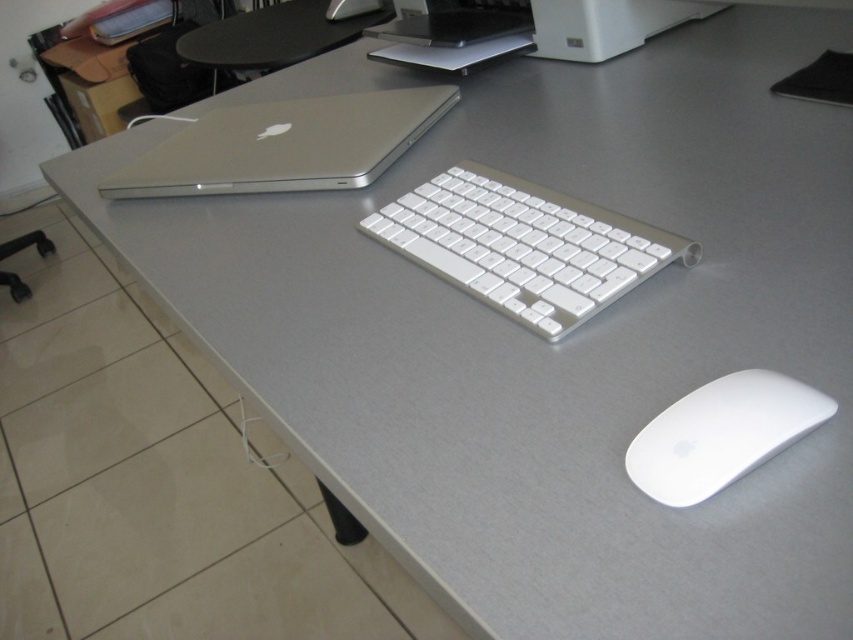
Question: Which of the following is the farthest from the observer?

Choices:
 (A) 515,308
 (B) 213,182
 (C) 653,484

Answer: (B)

Question: From the image, what is the correct spatial relationship of white plastic keyboard at center in relation to white matte mouse at lower right?

Choices:
 (A) left
 (B) right

Answer: (A)

Question: Which object appears farthest from the camera in this image?

Choices:
 (A) white plastic keyboard at center
 (B) white matte mouse at lower right
 (C) silver metallic laptop at upper left

Answer: (C)

Question: Which object is farther from the camera taking this photo?

Choices:
 (A) silver metallic laptop at upper left
 (B) white matte mouse at lower right
 (C) white plastic keyboard at center

Answer: (A)

Question: In this image, where is white plastic keyboard at center located relative to silver metallic laptop at upper left?

Choices:
 (A) right
 (B) left

Answer: (A)

Question: Is silver metallic laptop at upper left positioned behind white matte mouse at lower right?

Choices:
 (A) no
 (B) yes

Answer: (B)